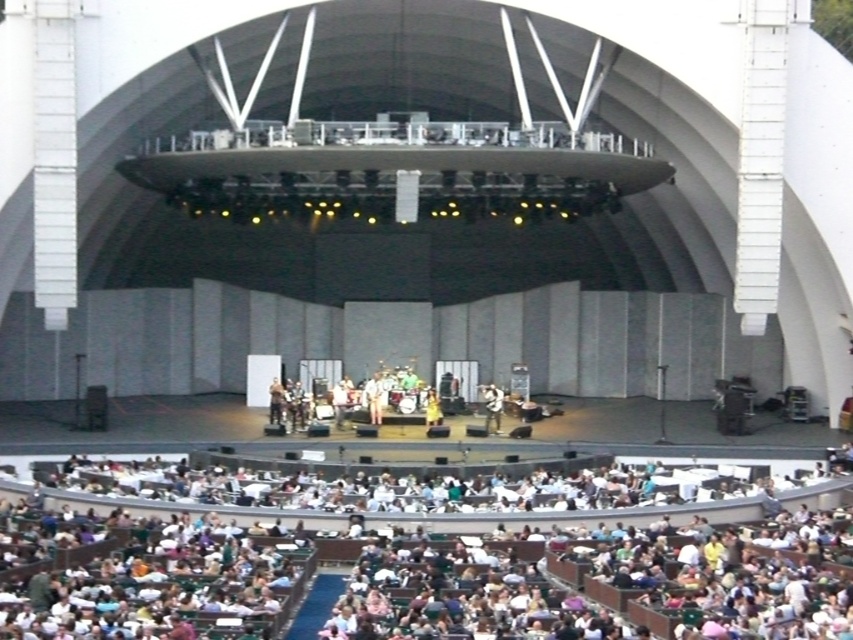
Is white fabric shirt at center to the left of white fabric dress at center stage from the viewer's perspective?

Incorrect, white fabric shirt at center is not on the left side of white fabric dress at center stage.

What do you see at coordinates (492, 406) in the screenshot? This screenshot has width=853, height=640. I see `white fabric shirt at center` at bounding box center [492, 406].

You are a GUI agent. You are given a task and a screenshot of the screen. Output one action in this format:
    pyautogui.click(x=<x>, y=<y>)
    Task: Click on the white fabric shirt at center
    
    Given the screenshot: What is the action you would take?
    pyautogui.click(x=492, y=406)

Is white fabric dress at center stage above matte black guitar at center?

Yes.

Who is higher up, white fabric dress at center stage or matte black guitar at center?

Positioned higher is white fabric dress at center stage.

Locate an element on the screen. white fabric dress at center stage is located at coordinates (339, 401).

Can you confirm if white fabric dress at center is positioned to the left of white fabric shirt at center?

Correct, you'll find white fabric dress at center to the left of white fabric shirt at center.

Does white fabric dress at center appear over white fabric shirt at center?

Indeed, white fabric dress at center is positioned over white fabric shirt at center.

Identify the location of white fabric dress at center. (374, 397).